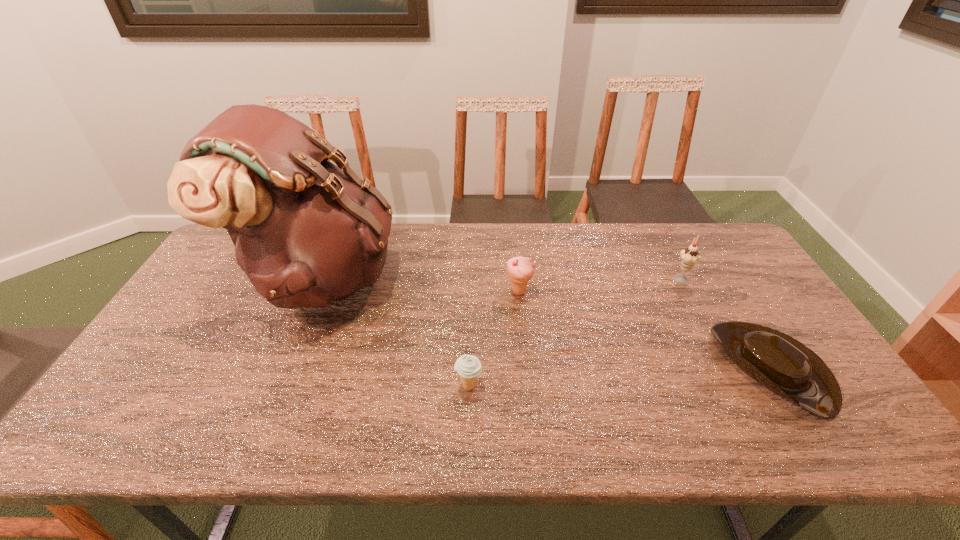
Find the location of a particular element. The image size is (960, 540). unoccupied area between the nearest icecream and the rightmost icecream is located at coordinates (574, 332).

Select which object is the second closest to the shortest icecream. Please provide its 2D coordinates. Your answer should be formatted as a tuple, i.e. [(x, y)], where the tuple contains the x and y coordinates of a point satisfying the conditions above.

[(520, 270)]

This screenshot has height=540, width=960. Identify the location of object that is the fourth closest to the second icecream from right to left. (785, 366).

The image size is (960, 540). Find the location of `the closest icecream to the leftmost object`. the closest icecream to the leftmost object is located at coordinates (468, 367).

You are a GUI agent. You are given a task and a screenshot of the screen. Output one action in this format:
    pyautogui.click(x=<x>, y=<y>)
    Task: Click on the closest icecream relative to the third object from left to right
    
    Given the screenshot: What is the action you would take?
    pyautogui.click(x=468, y=367)

Where is `blank area in the image that satisfies the following two spatial constraints: 1. at the front of the rightmost icecream with buckles; 2. on the right side of the satchel`? The width and height of the screenshot is (960, 540). blank area in the image that satisfies the following two spatial constraints: 1. at the front of the rightmost icecream with buckles; 2. on the right side of the satchel is located at coordinates click(323, 278).

The height and width of the screenshot is (540, 960). Find the location of `vacant region that satisfies the following two spatial constraints: 1. at the front of the cowboy hat with buckles; 2. on the left side of the tallest object`. vacant region that satisfies the following two spatial constraints: 1. at the front of the cowboy hat with buckles; 2. on the left side of the tallest object is located at coordinates (286, 368).

You are a GUI agent. You are given a task and a screenshot of the screen. Output one action in this format:
    pyautogui.click(x=<x>, y=<y>)
    Task: Click on the free space in the image that satisfies the following two spatial constraints: 1. at the front of the tallest object with buckles; 2. on the left side of the cowboy hat
    This screenshot has width=960, height=540.
    Given the screenshot: What is the action you would take?
    pyautogui.click(x=286, y=368)

Find the location of a particular element. The width and height of the screenshot is (960, 540). vacant region that satisfies the following two spatial constraints: 1. at the front of the satchel with buckles; 2. on the back side of the rightmost icecream is located at coordinates [x=323, y=278].

I want to click on free space that satisfies the following two spatial constraints: 1. on the front side of the shortest object; 2. on the right side of the rightmost icecream, so click(727, 368).